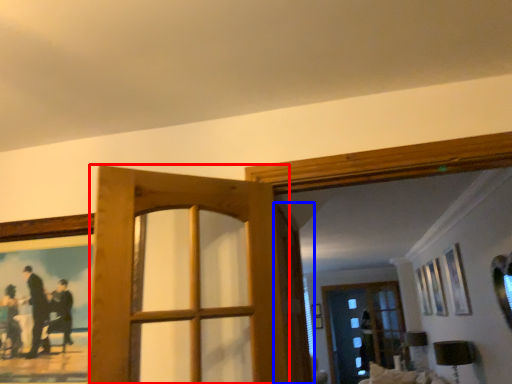
Question: Which object appears closest to the camera in this image, door (highlighted by a red box) or screen door (highlighted by a blue box)?

Choices:
 (A) door
 (B) screen door

Answer: (A)